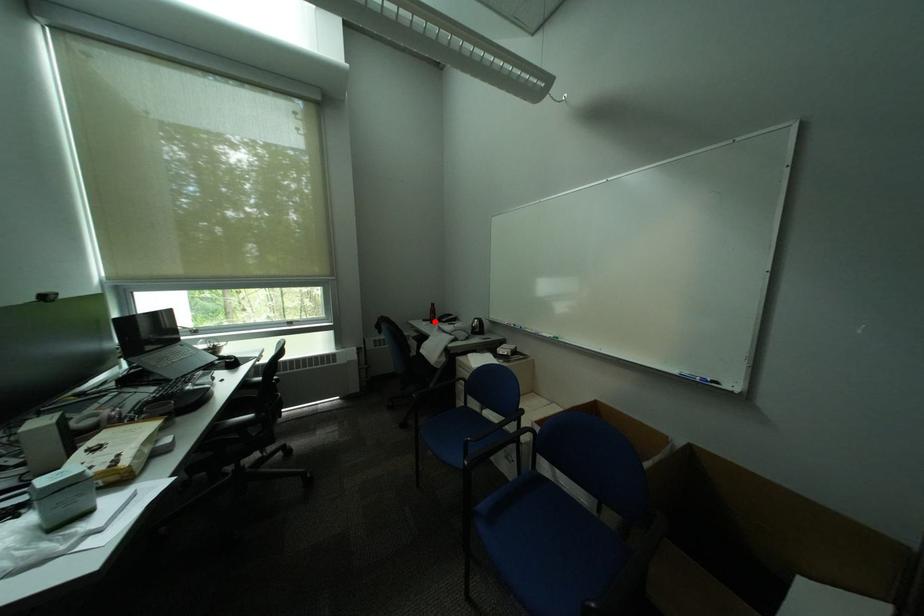
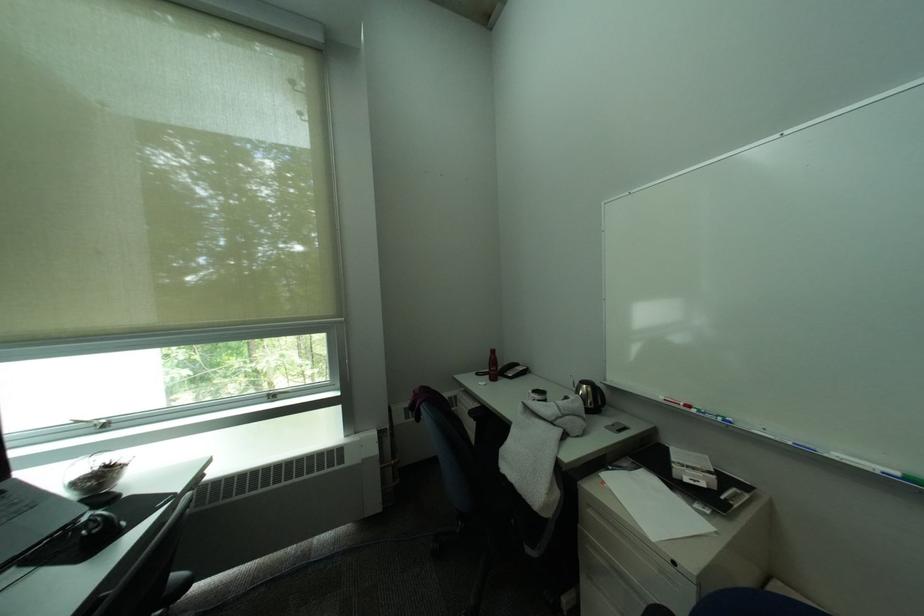
In the second image, find the point that corresponds to the highlighted location in the first image.

(488, 376)